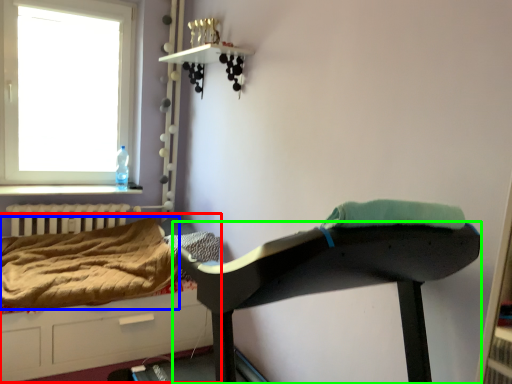
Question: Which object is positioned closest to hospital bed (highlighted by a red box)? Select from blanket (highlighted by a blue box) and furniture (highlighted by a green box).

Choices:
 (A) blanket
 (B) furniture

Answer: (A)